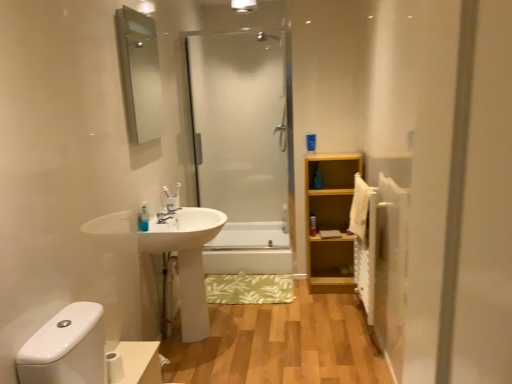
This screenshot has width=512, height=384. Describe the element at coordinates (331, 221) in the screenshot. I see `light wood shelf at right` at that location.

In order to face white textured radiator at right, should I rotate leftwards or rightwards?

To align with it, rotate right about 14.705°.

Measure the distance between point (146,227) and camera.

The distance of point (146,227) from camera is 2.44 meters.

The height and width of the screenshot is (384, 512). Find the location of `white glossy bathtub at center`. white glossy bathtub at center is located at coordinates (248, 250).

In the image, there is a transparent glass shower door at center. Where is `radiator below it (from a real-world perspective)`? radiator below it (from a real-world perspective) is located at coordinates (364, 245).

From a real-world perspective, does white textured radiator at right sit lower than transparent glass shower door at center?

Indeed, from a real-world perspective, white textured radiator at right is positioned beneath transparent glass shower door at center.

From the picture: In terms of height, does white textured radiator at right look taller or shorter compared to transparent glass shower door at center?

white textured radiator at right is shorter than transparent glass shower door at center.

Between white glossy toilet paper at lower left and white textured radiator at right, which one appears on the left side from the viewer's perspective?

white glossy toilet paper at lower left is more to the left.

Which is nearer, (134, 354) or (360, 244)?

Point (134, 354) appears to be closer to the viewer than point (360, 244).

In the scene shown: Is white textured radiator at right at the back of white glossy toilet paper at lower left?

white glossy toilet paper at lower left is not turned away from white textured radiator at right.

Which of these two, translucent plastic container at right, the 2th toiletry positioned from the left, or white matte toilet paper at lower left, stands taller?

translucent plastic container at right, the 2th toiletry positioned from the left, is taller.

Where is `toiletry that appears on the right of white matte toilet paper at lower left`? toiletry that appears on the right of white matte toilet paper at lower left is located at coordinates (313, 224).

Based on the photo, is translucent plastic container at right, the 2th toiletry positioned from the left, inside or outside of white matte toilet paper at lower left?

translucent plastic container at right, the 2th toiletry positioned from the left, exists outside the volume of white matte toilet paper at lower left.

Is translucent plastic container at right, which appears as the second toiletry when viewed from the front, bigger than white matte toilet paper at lower left?

Yes, translucent plastic container at right, which appears as the second toiletry when viewed from the front, is bigger than white matte toilet paper at lower left.

From the image's perspective, which is above, light brown wood floor at lower center or white matte toilet paper at lower left?

white matte toilet paper at lower left is shown above in the image.

Is light brown wood floor at lower center in front of or behind white matte toilet paper at lower left in the image?

In the image, light brown wood floor at lower center appears behind white matte toilet paper at lower left.

How many degrees apart are the facing directions of light brown wood floor at lower center and white matte toilet paper at lower left?

They differ by 87.5 degrees in their facing directions.

Between point (112, 371) and point (210, 96), which one is positioned behind?

The point (210, 96) is farther from the camera.

Relative to transparent glass shower door at center, is white matte toilet paper at lower left in front or behind?

white matte toilet paper at lower left is positioned closer to the viewer than transparent glass shower door at center.

Can you confirm if white matte toilet paper at lower left is thinner than transparent glass shower door at center?

Indeed, white matte toilet paper at lower left has a lesser width compared to transparent glass shower door at center.

From the image's perspective, between white matte toilet paper at lower left and transparent glass shower door at center, who is located below?

white matte toilet paper at lower left appears lower in the image.

Is light brown wood floor at lower center touching light wood shelf at right?

There is a gap between light brown wood floor at lower center and light wood shelf at right.

From the image's perspective, relative to light wood shelf at right, is light brown wood floor at lower center above or below?

From the image's perspective, light brown wood floor at lower center appears below light wood shelf at right.

Does light brown wood floor at lower center have a lesser width compared to light wood shelf at right?

No, light brown wood floor at lower center is not thinner than light wood shelf at right.

The image size is (512, 384). What are the coordinates of `hardwood located underneath the light wood shelf at right (from a real-world perspective)` in the screenshot? It's located at (280, 344).

Is point (234, 339) less distant than point (139, 215)?

That is False.

Is translucent plastic soap at left, placed as the first toiletry when sorted from front to back, at the back of light brown wood floor at lower center?

light brown wood floor at lower center is not turned away from translucent plastic soap at left, placed as the first toiletry when sorted from front to back.

Would you consider light brown wood floor at lower center to be distant from translucent plastic soap at left, the 2th toiletry from the back?

Yes, light brown wood floor at lower center is far from translucent plastic soap at left, the 2th toiletry from the back.

This screenshot has height=384, width=512. What are the coordinates of `hardwood on the right of translucent plastic soap at left, marked as the first toiletry in a left-to-right arrangement` in the screenshot? It's located at (280, 344).

Identify the location of screen door located above the white textured radiator at right (from a real-world perspective). The width and height of the screenshot is (512, 384). (239, 125).

Find the location of `counter top below the white textured radiator at right (from the image's perspective)`. counter top below the white textured radiator at right (from the image's perspective) is located at coordinates (139, 362).

From the picture: Considering their positions, is translucent plastic soap at left, placed as the first toiletry when sorted from front to back, positioned further to light wood shelf at right than transparent glass shower door at center?

translucent plastic soap at left, placed as the first toiletry when sorted from front to back.

Considering their positions, is white glossy light fixture at upper center positioned closer to translucent plastic soap at left, marked as the 2th toiletry in a right-to-left arrangement, than transparent glass shower door at center?

transparent glass shower door at center is positioned closer to the anchor translucent plastic soap at left, marked as the 2th toiletry in a right-to-left arrangement.

Looking at the image, which one is located further to white matte toilet paper at lower left, transparent glass shower door at center or white glossy light fixture at upper center?

Among the two, white glossy light fixture at upper center is located further to white matte toilet paper at lower left.

Estimate the real-world distances between objects in this image. Which object is further from light wood shelf at right, translucent plastic soap at left, marked as the first toiletry in a left-to-right arrangement, or translucent plastic container at right, marked as the 1th toiletry in a right-to-left arrangement?

translucent plastic soap at left, marked as the first toiletry in a left-to-right arrangement, is further to light wood shelf at right.

When comparing their distances from white glossy bathtub at center, does light wood shelf at right or white glossy sink at center left seem closer?

light wood shelf at right is closer to white glossy bathtub at center.

Estimate the real-world distances between objects in this image. Which object is further from white matte toilet paper at lower left, translucent plastic soap at left, marked as the first toiletry in a left-to-right arrangement, or light brown wood floor at lower center?

light brown wood floor at lower center is further to white matte toilet paper at lower left.

Estimate the real-world distances between objects in this image. Which object is closer to white textured radiator at right, white glossy toilet paper at lower left or white glossy sink at center left?

white glossy sink at center left is closer to white textured radiator at right.

Considering their positions, is white glossy sink at center left positioned closer to white glossy bathtub at center than translucent plastic soap at left, the 2th toiletry from the back?

Among the two, white glossy sink at center left is located nearer to white glossy bathtub at center.

The image size is (512, 384). Identify the location of toiletry between white glossy toilet paper at lower left and translucent plastic container at right, which appears as the second toiletry when viewed from the front, along the z-axis. (144, 218).

At what (x,y) coordinates should I click in order to perform the action: click on bathroom cabinet positioned between light brown wood floor at lower center and white glossy bathtub at center from near to far. Please return your answer as a coordinate pair (x, y). The width and height of the screenshot is (512, 384). Looking at the image, I should click on (331, 221).

Locate an element on the screen. sink situated between translucent plastic soap at left, placed as the first toiletry when sorted from front to back, and white textured radiator at right from left to right is located at coordinates (187, 261).

The height and width of the screenshot is (384, 512). Identify the location of sink between clear glass mirror at upper left and white glossy toilet paper at lower left in the up-down direction. (187, 261).